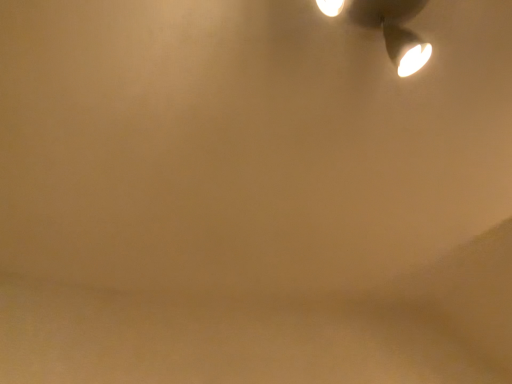
This screenshot has height=384, width=512. Describe the element at coordinates (387, 27) in the screenshot. I see `white glossy lamp at upper right` at that location.

The image size is (512, 384). I want to click on white glossy lamp at upper right, so coord(387,27).

You are a GUI agent. You are given a task and a screenshot of the screen. Output one action in this format:
    pyautogui.click(x=<x>, y=<y>)
    Task: Click on the white glossy lamp at upper right
    The image size is (512, 384).
    Given the screenshot: What is the action you would take?
    click(x=387, y=27)